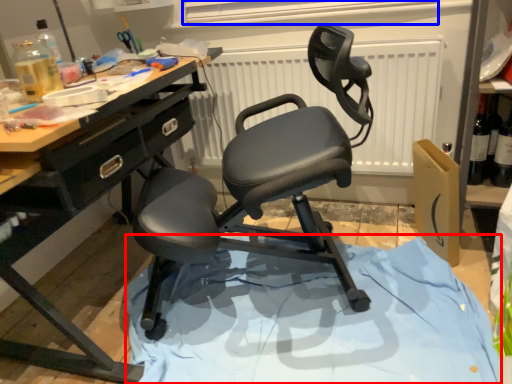
Question: Which object is closer to the camera taking this photo, fabric (highlighted by a red box) or window screen (highlighted by a blue box)?

Choices:
 (A) fabric
 (B) window screen

Answer: (A)